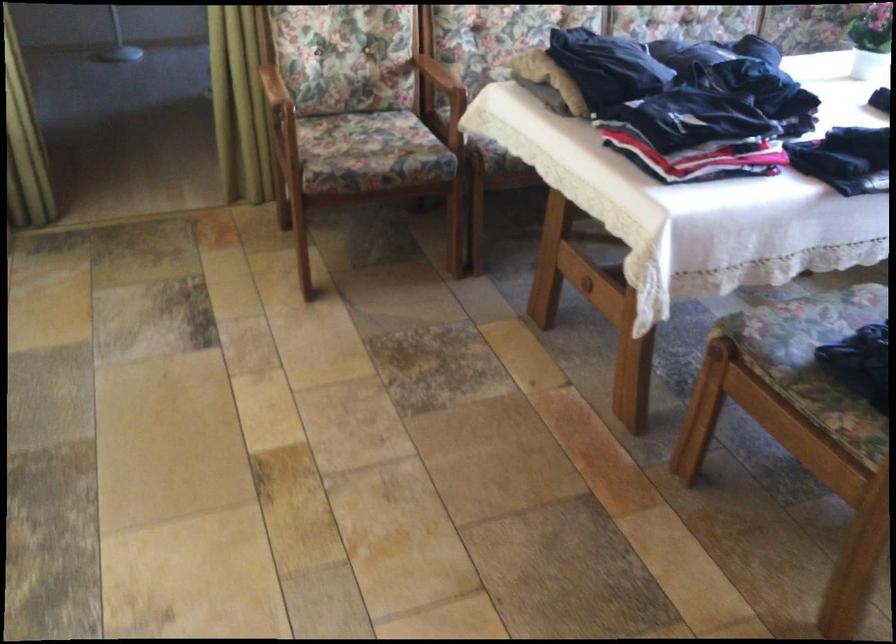
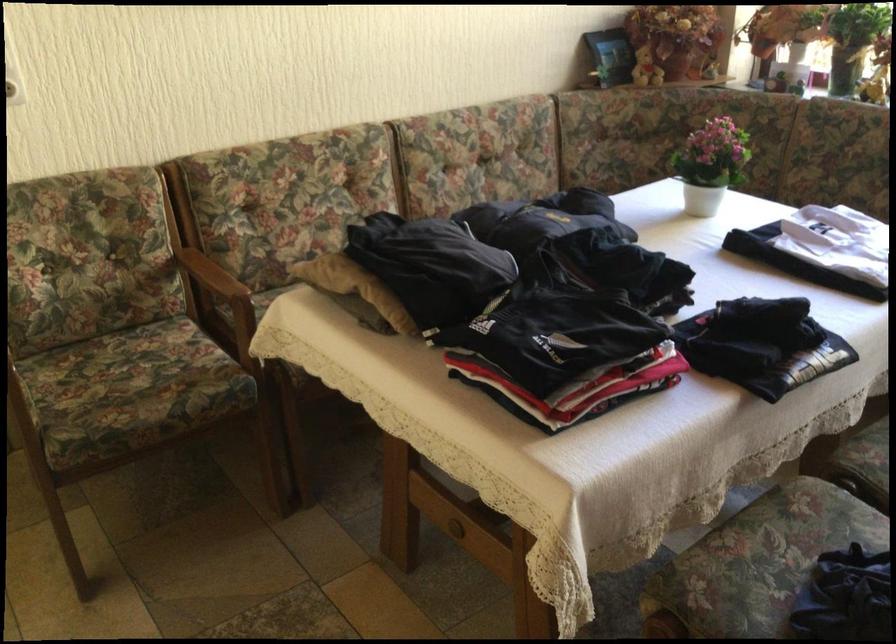
The point at (541,76) is marked in the first image. Where is the corresponding point in the second image?

(355, 287)